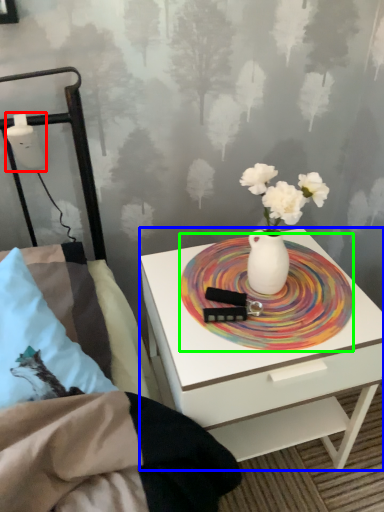
Question: Which is nearer to the table lamp (highlighted by a red box)? nightstand (highlighted by a blue box) or platter (highlighted by a green box).

Choices:
 (A) nightstand
 (B) platter

Answer: (B)